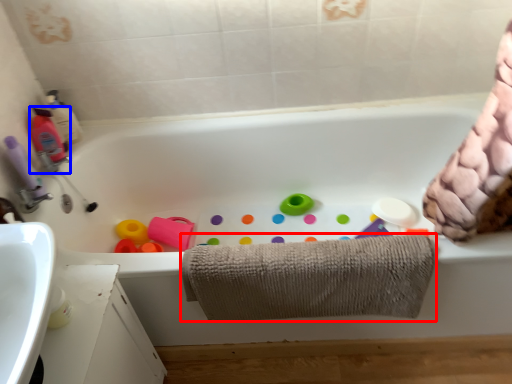
Question: Which object appears closest to the camera in this image, towel (highlighted by a red box) or cleaning product (highlighted by a blue box)?

Choices:
 (A) towel
 (B) cleaning product

Answer: (A)